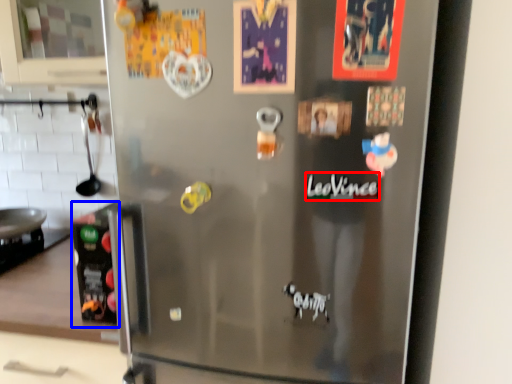
Question: Which of the following is the closest to the observer, writing (highlighted by a red box) or appliance (highlighted by a blue box)?

Choices:
 (A) writing
 (B) appliance

Answer: (A)